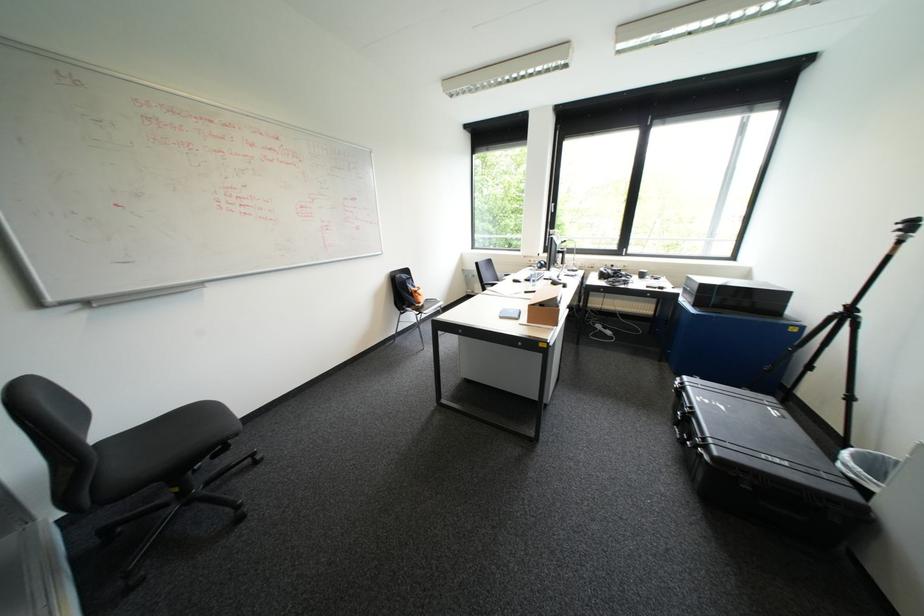
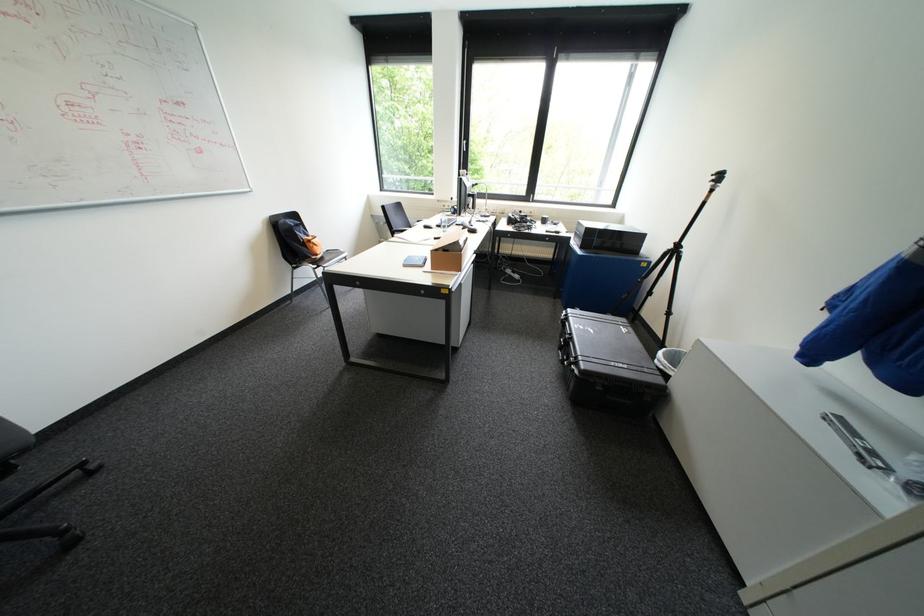
Find the pixel in the second image that matches the point at 509,310 in the first image.

(415, 257)